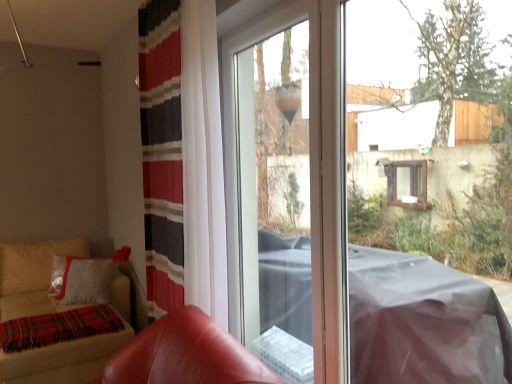
Question: From the image's perspective, would you say transparent plastic screen door at center is positioned over plaid woolen blanket at lower left?

Choices:
 (A) no
 (B) yes

Answer: (B)

Question: Is transparent plastic screen door at center positioned in front of plaid woolen blanket at lower left?

Choices:
 (A) no
 (B) yes

Answer: (B)

Question: Is plaid woolen blanket at lower left completely or partially inside transparent plastic screen door at center?

Choices:
 (A) no
 (B) yes

Answer: (A)

Question: Is transparent plastic screen door at center aimed at plaid woolen blanket at lower left?

Choices:
 (A) yes
 (B) no

Answer: (B)

Question: Is transparent plastic screen door at center thinner than plaid woolen blanket at lower left?

Choices:
 (A) yes
 (B) no

Answer: (A)

Question: Does transparent plastic screen door at center appear on the left side of plaid woolen blanket at lower left?

Choices:
 (A) no
 (B) yes

Answer: (A)

Question: Can you confirm if leather armchair at lower left is wider than transparent plastic screen door at center?

Choices:
 (A) yes
 (B) no

Answer: (A)

Question: Is the position of leather armchair at lower left less distant than that of transparent plastic screen door at center?

Choices:
 (A) no
 (B) yes

Answer: (B)

Question: Considering the relative positions of leather armchair at lower left and transparent plastic screen door at center in the image provided, is leather armchair at lower left to the left of transparent plastic screen door at center from the viewer's perspective?

Choices:
 (A) no
 (B) yes

Answer: (B)

Question: Is leather armchair at lower left positioned behind transparent plastic screen door at center?

Choices:
 (A) yes
 (B) no

Answer: (B)

Question: Does leather armchair at lower left touch transparent plastic screen door at center?

Choices:
 (A) no
 (B) yes

Answer: (A)

Question: From the image's perspective, is leather armchair at lower left located above transparent plastic screen door at center?

Choices:
 (A) yes
 (B) no

Answer: (B)

Question: Can you confirm if velvet beige sofa at lower left is wider than transparent plastic screen door at center?

Choices:
 (A) no
 (B) yes

Answer: (B)